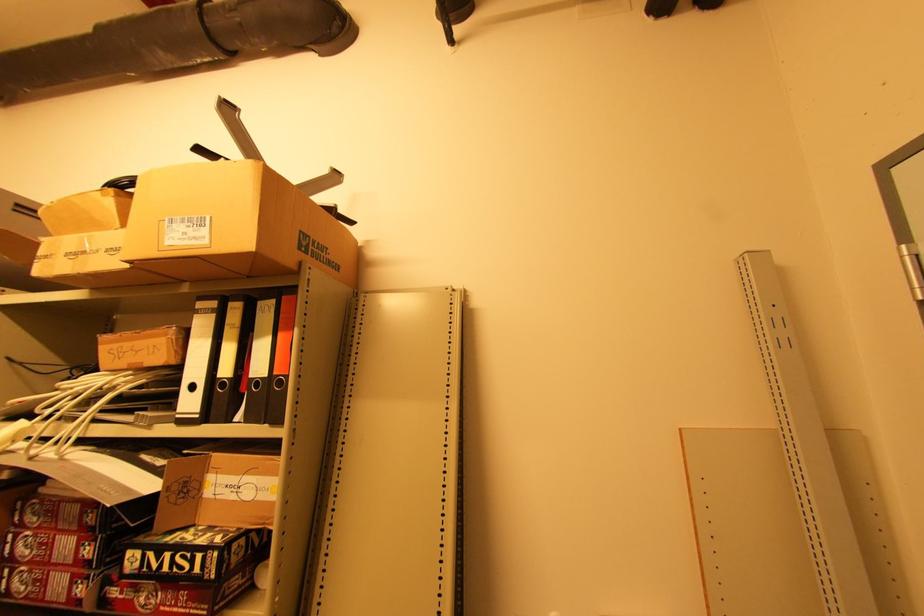
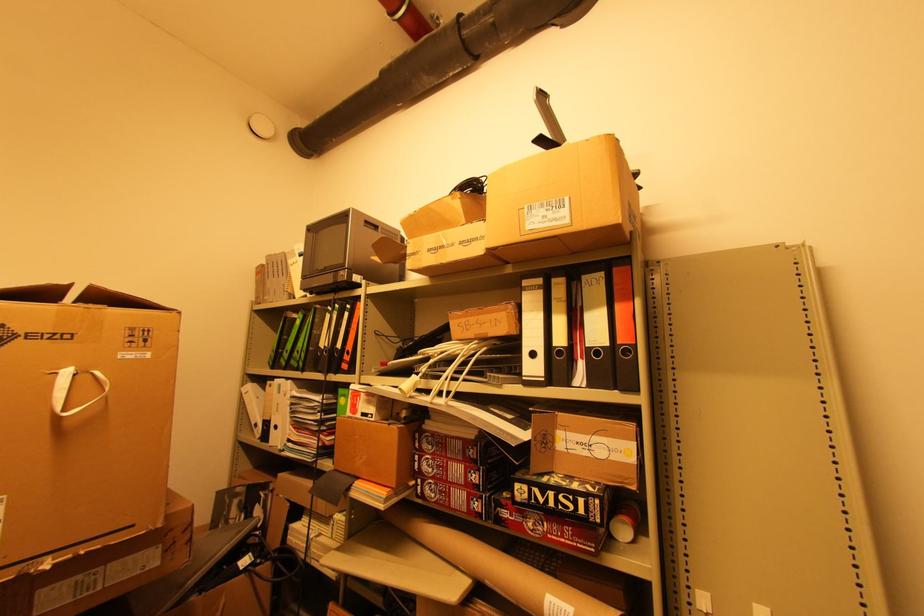
Question: The camera is either moving clockwise (left) or counter-clockwise (right) around the object. The first image is from the beginning of the video and the second image is from the end. Is the camera moving left or right when shooting the video?

Choices:
 (A) Left
 (B) Right

Answer: (B)